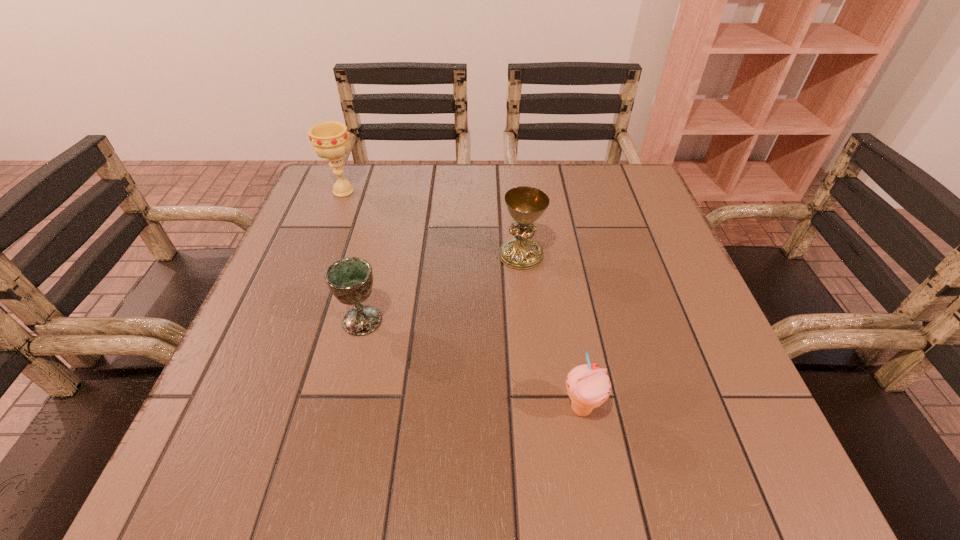
I want to click on vacant space situated on the back of the nearest object, so click(x=563, y=304).

Find the location of a particular element. The width and height of the screenshot is (960, 540). object at the far edge is located at coordinates (330, 140).

The width and height of the screenshot is (960, 540). In order to click on object at the near edge in this screenshot , I will do `click(588, 386)`.

Identify the location of object that is at the left edge. This screenshot has width=960, height=540. (330, 140).

The image size is (960, 540). What are the coordinates of `object that is positioned at the far left corner` in the screenshot? It's located at (330, 140).

In the image, there is a desktop. Where is `blank space at the far edge`? Image resolution: width=960 pixels, height=540 pixels. blank space at the far edge is located at coordinates (470, 199).

Identify the location of blank space at the near edge. (336, 454).

Locate an element on the screen. free space at the left edge is located at coordinates (273, 409).

Where is `vacant area at the right edge of the desktop`? The width and height of the screenshot is (960, 540). vacant area at the right edge of the desktop is located at coordinates (645, 244).

In order to click on free space at the far left corner of the desktop in this screenshot , I will do [x=351, y=172].